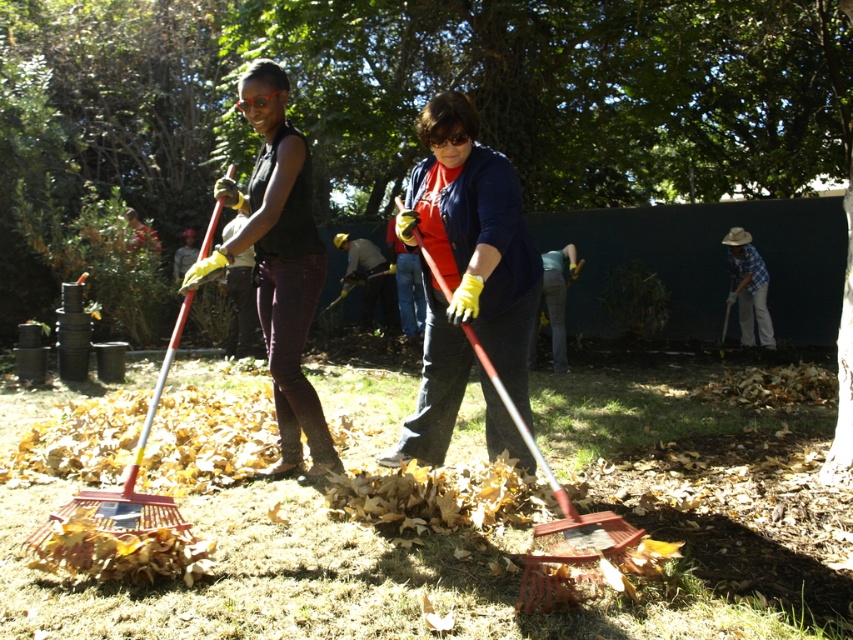
Question: Which point appears farthest from the camera in this image?

Choices:
 (A) (598, 525)
 (B) (287, 211)
 (C) (436, 346)

Answer: (C)

Question: Considering the relative positions of red plastic shovel at center and dark gray fabric shirt at center in the image provided, where is red plastic shovel at center located with respect to dark gray fabric shirt at center?

Choices:
 (A) left
 (B) right

Answer: (B)

Question: Estimate the real-world distances between objects in this image. Which object is closer to the red plastic shovel at center?

Choices:
 (A) denim pants at center
 (B) dark gray fabric shirt at center
 (C) matte black shirt at center

Answer: (C)

Question: Among these points, which one is farthest from the camera?

Choices:
 (A) (549, 278)
 (B) (529, 282)
 (C) (755, 282)
 (D) (363, 260)

Answer: (D)

Question: Where is matte yellow gloves at center located in relation to dark gray fabric shirt at center in the image?

Choices:
 (A) below
 (B) above

Answer: (A)

Question: Is matte yellow gloves at center thinner than red plastic shovel at center?

Choices:
 (A) yes
 (B) no

Answer: (A)